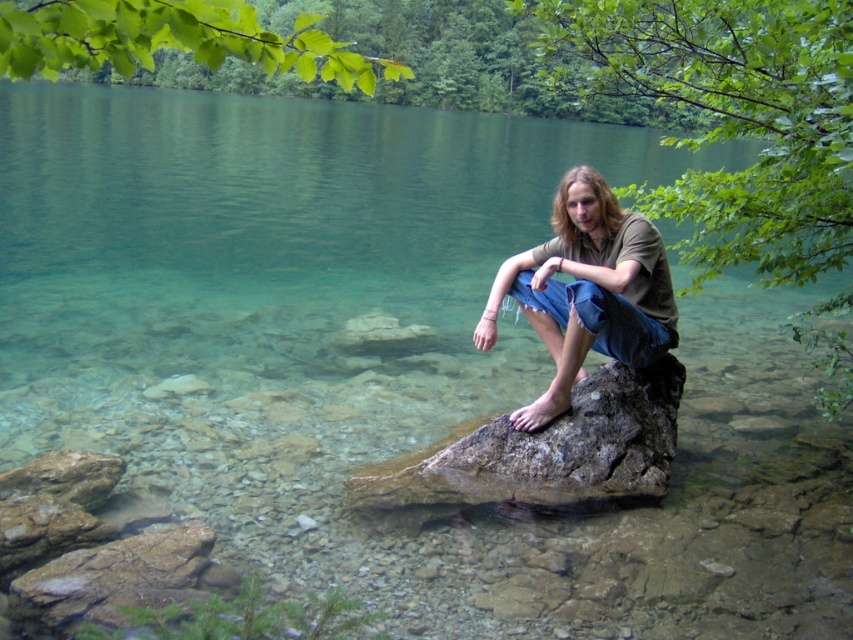
Is point (567, 372) farther from viewer compared to point (161, 563)?

Yes, it is.

Does brown cotton shirt at center appear on the right side of brown rough rock at lower left?

Yes, brown cotton shirt at center is to the right of brown rough rock at lower left.

This screenshot has width=853, height=640. Describe the element at coordinates (587, 291) in the screenshot. I see `brown cotton shirt at center` at that location.

Image resolution: width=853 pixels, height=640 pixels. Find the location of `brown cotton shirt at center`. brown cotton shirt at center is located at coordinates (587, 291).